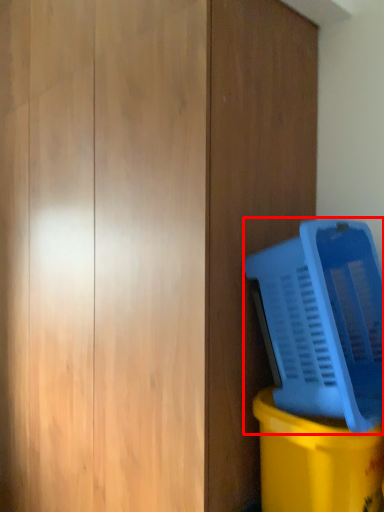
Question: From the image, what is the correct spatial relationship of water cooler (annotated by the red box) in relation to waste container?

Choices:
 (A) left
 (B) right

Answer: (A)